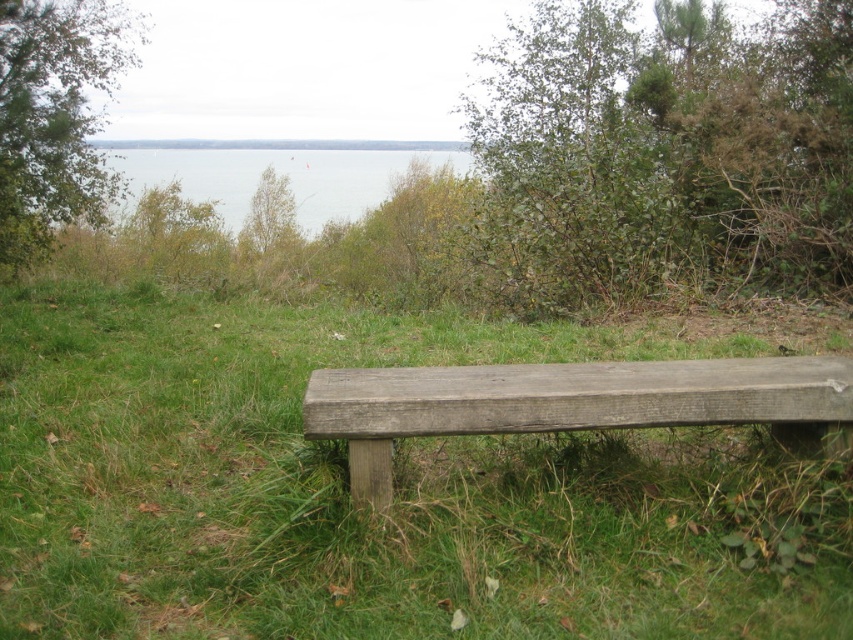
Question: Among these objects, which one is nearest to the camera?

Choices:
 (A) green leafy tree at upper left
 (B) green rough wood bench at center
 (C) green leafy bush at upper right

Answer: (B)

Question: Which of these objects is positioned farthest from the weathered wood bench at lower center?

Choices:
 (A) blue water at upper center
 (B) green leafy tree at upper left

Answer: (B)

Question: Which of the following is the farthest from the observer?

Choices:
 (A) weathered wood bench at lower center
 (B) blue water at upper center

Answer: (B)

Question: Is weathered wood bench at lower center smaller than blue water at upper center?

Choices:
 (A) yes
 (B) no

Answer: (B)

Question: Can you confirm if weathered wood bench at lower center is positioned to the right of blue water at upper center?

Choices:
 (A) yes
 (B) no

Answer: (A)

Question: Is green rough wood bench at center smaller than blue water at upper center?

Choices:
 (A) no
 (B) yes

Answer: (A)